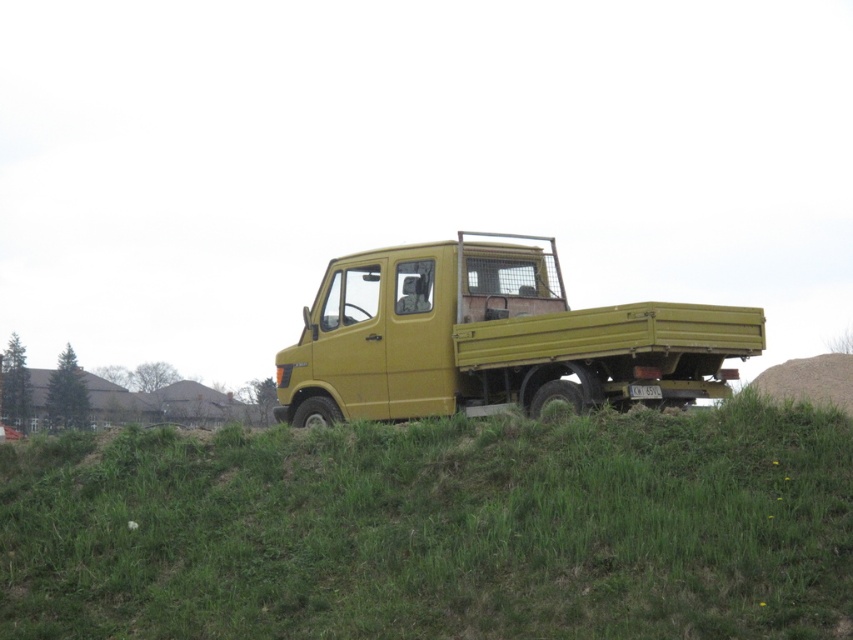
Is green grassy hillside at center further to camera compared to matte yellow truck at center?

No.

Does point (554, 500) come in front of point (431, 330)?

Yes, point (554, 500) is closer to viewer.

Locate an element on the screen. green grassy hillside at center is located at coordinates (437, 529).